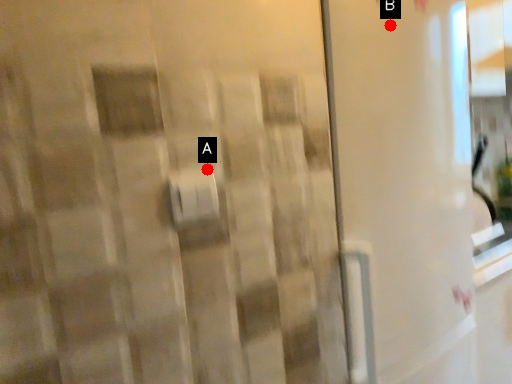
Question: Two points are circled on the image, labeled by A and B beside each circle. Among these points, which one is farthest from the camera?

Choices:
 (A) A is further
 (B) B is further

Answer: (B)